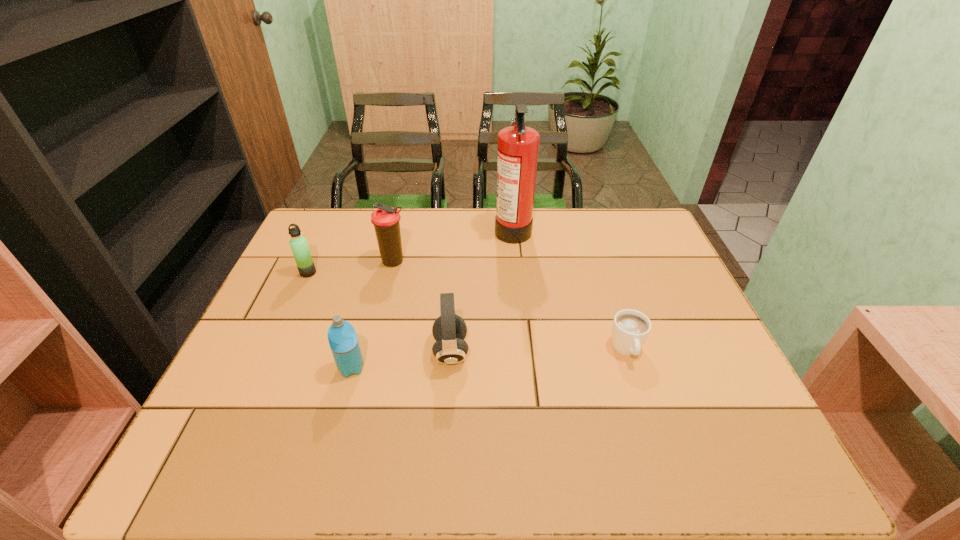
At what (x,y) coordinates should I click in order to perform the action: click on free spot located on the front-facing side of the fifth object from left to right. Please return your answer as a coordinate pair (x, y). This screenshot has height=540, width=960. Looking at the image, I should click on (424, 228).

In order to click on free space located 0.340m on the right of the fifth shortest object in this screenshot , I will do `click(522, 262)`.

This screenshot has width=960, height=540. Identify the location of free space located 0.210m on the back of the leftmost object. (328, 227).

What are the coordinates of `vacant area located on the ear cups of the fourth object from left to right` in the screenshot? It's located at (587, 352).

The height and width of the screenshot is (540, 960). I want to click on vacant space situated 0.070m on the back of the nearest thermos bottle, so click(x=360, y=335).

Find the location of a particular element. free space located with the handle on the side of the cappuccino is located at coordinates (646, 410).

Find the location of `object at the far edge`. object at the far edge is located at coordinates (518, 145).

I want to click on object present at the left edge, so click(298, 243).

Where is `blank area at the far edge`? blank area at the far edge is located at coordinates (556, 239).

Identify the location of free location at the near edge of the desktop. (351, 440).